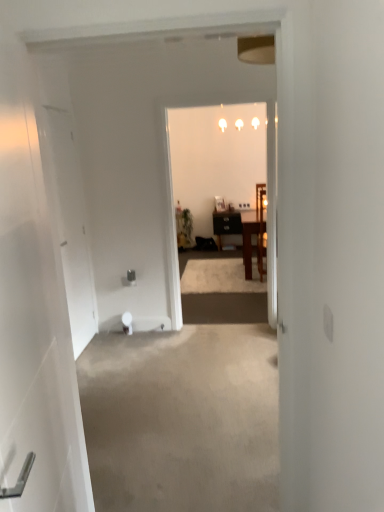
Question: Is white glossy door at left, which is counted as the 1th door, starting from the front, taller than green matte houseplant at center?

Choices:
 (A) no
 (B) yes

Answer: (B)

Question: Is white glossy door at left, which is counted as the 1th door, starting from the front, oriented towards green matte houseplant at center?

Choices:
 (A) yes
 (B) no

Answer: (B)

Question: Is white glossy door at left, which is counted as the 1th door, starting from the front, surrounding green matte houseplant at center?

Choices:
 (A) yes
 (B) no

Answer: (B)

Question: Can you confirm if white glossy door at left, which is counted as the 1th door, starting from the front, is shorter than green matte houseplant at center?

Choices:
 (A) yes
 (B) no

Answer: (B)

Question: Considering the relative positions of white glossy door at left, the 2th door in the left-to-right sequence, and green matte houseplant at center in the image provided, is white glossy door at left, the 2th door in the left-to-right sequence, to the right of green matte houseplant at center from the viewer's perspective?

Choices:
 (A) no
 (B) yes

Answer: (A)

Question: Can you confirm if white glossy door at left, positioned as the second door in back-to-front order, is wider than green matte houseplant at center?

Choices:
 (A) yes
 (B) no

Answer: (B)

Question: Does white glossy door at left, the first door viewed from the right, have a greater height compared to wooden chair at center, the 2th chair positioned from the back?

Choices:
 (A) yes
 (B) no

Answer: (A)

Question: From a real-world perspective, is white glossy door at left, the 2th door in the left-to-right sequence, over wooden chair at center, the first chair from the front?

Choices:
 (A) yes
 (B) no

Answer: (A)

Question: Is white glossy door at left, which is counted as the 1th door, starting from the front, directly adjacent to wooden chair at center, the 2th chair positioned from the back?

Choices:
 (A) yes
 (B) no

Answer: (B)

Question: From the image's perspective, would you say white glossy door at left, positioned as the second door in back-to-front order, is positioned over wooden chair at center, the 2th chair positioned from the back?

Choices:
 (A) yes
 (B) no

Answer: (B)

Question: From the image's perspective, would you say white glossy door at left, the 2th door in the left-to-right sequence, is shown under wooden chair at center, the first chair from the front?

Choices:
 (A) yes
 (B) no

Answer: (A)

Question: Considering the relative positions of white glossy door at left, positioned as the second door in back-to-front order, and wooden chair at center, the first chair from the front, in the image provided, is white glossy door at left, positioned as the second door in back-to-front order, to the right of wooden chair at center, the first chair from the front, from the viewer's perspective?

Choices:
 (A) yes
 (B) no

Answer: (B)

Question: Can you confirm if wooden chair at center, which is the first chair in back-to-front order, is bigger than white glossy light fixture at upper center?

Choices:
 (A) no
 (B) yes

Answer: (B)